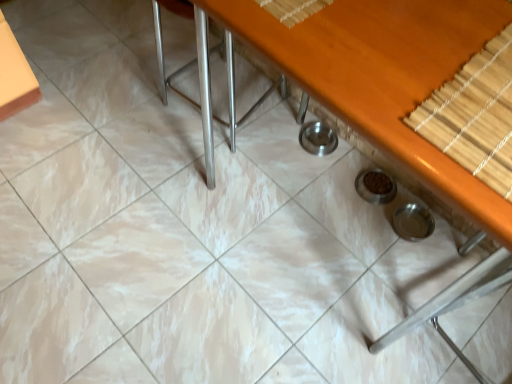
Locate an element on the screen. The height and width of the screenshot is (384, 512). vacant space positioned to the left of wooden table at center is located at coordinates (162, 167).